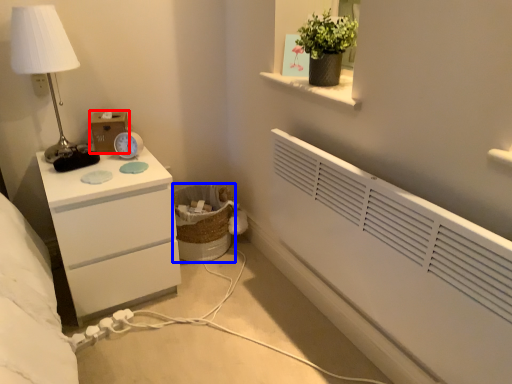
Question: Which of the following is the closest to the observer, box (highlighted by a red box) or laundry basket (highlighted by a blue box)?

Choices:
 (A) box
 (B) laundry basket

Answer: (A)